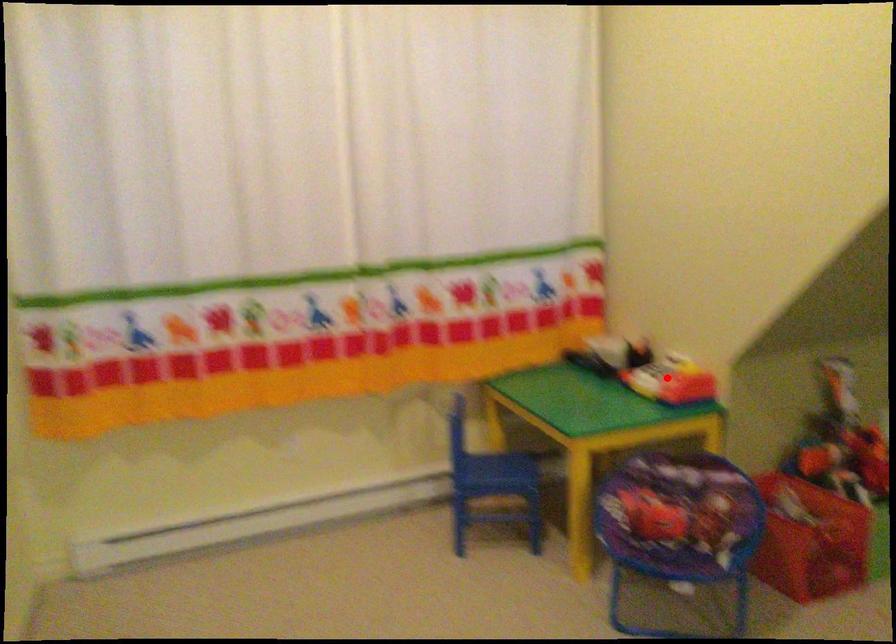
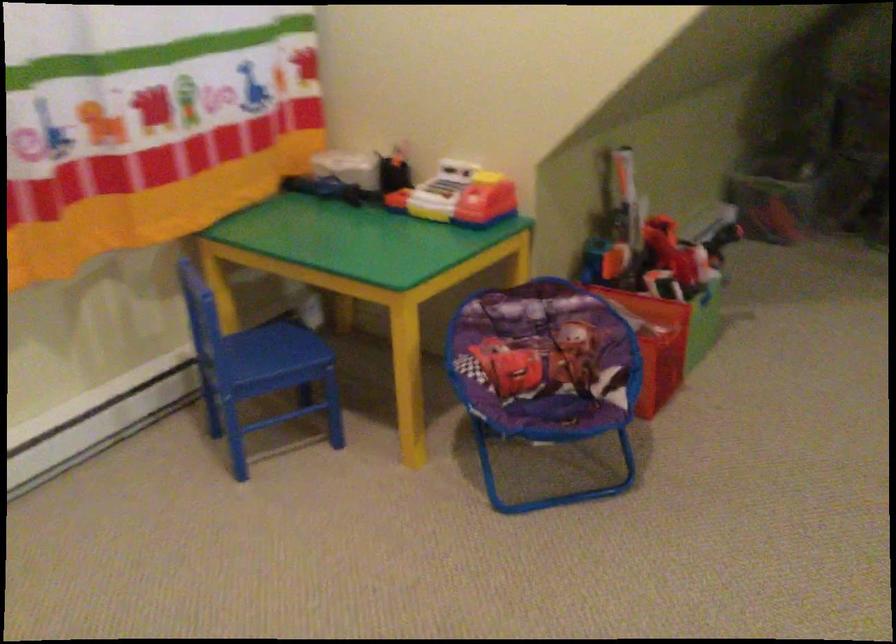
Question: I am providing you with two images of the same scene from different viewpoints. Given a red point in image1, look at the same physical point in image2. Is it:

Choices:
 (A) Closer to the viewpoint
 (B) Farther from the viewpoint

Answer: (A)